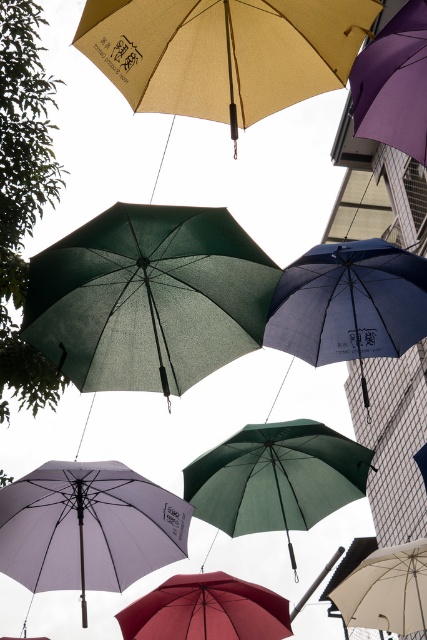
Question: Does green leafy tree at left have a smaller size compared to matte blue umbrella at center?

Choices:
 (A) no
 (B) yes

Answer: (B)

Question: Which point appears closest to the camera in this image?

Choices:
 (A) (397, 118)
 (B) (300, 518)
 (C) (406, 611)

Answer: (A)

Question: Does matte blue umbrella at center have a smaller size compared to matte green umbrella at center?

Choices:
 (A) no
 (B) yes

Answer: (B)

Question: Is matte blue umbrella at center thinner than matte red umbrella at center?

Choices:
 (A) no
 (B) yes

Answer: (B)

Question: Which of these objects is positioned closest to the matte green umbrella at center?

Choices:
 (A) green matte umbrella at upper center
 (B) green leafy tree at left
 (C) purple matte umbrella at upper right

Answer: (A)

Question: Among these points, which one is nearest to the camera?

Choices:
 (A) (134, 604)
 (B) (233, 332)
 (C) (330, 458)
 (D) (259, 26)

Answer: (D)